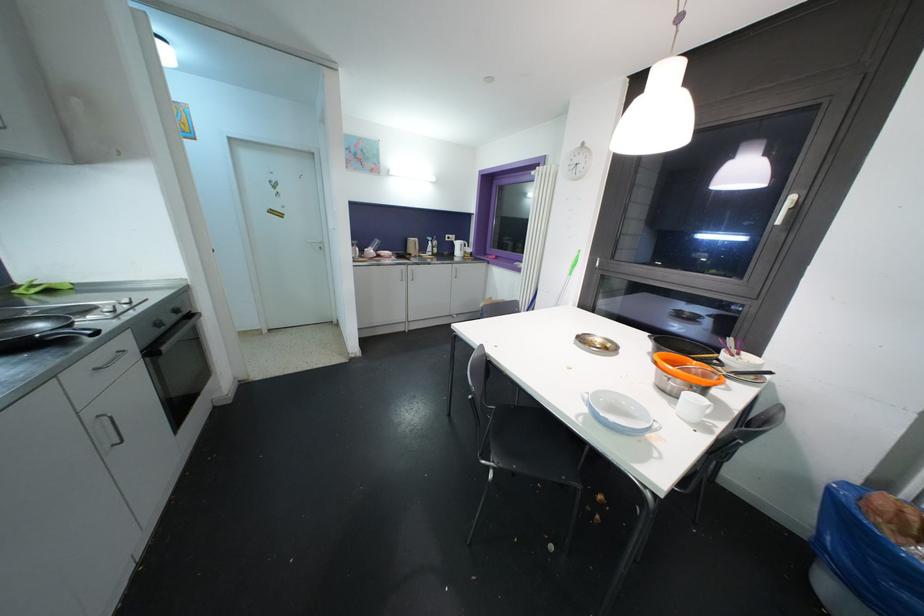
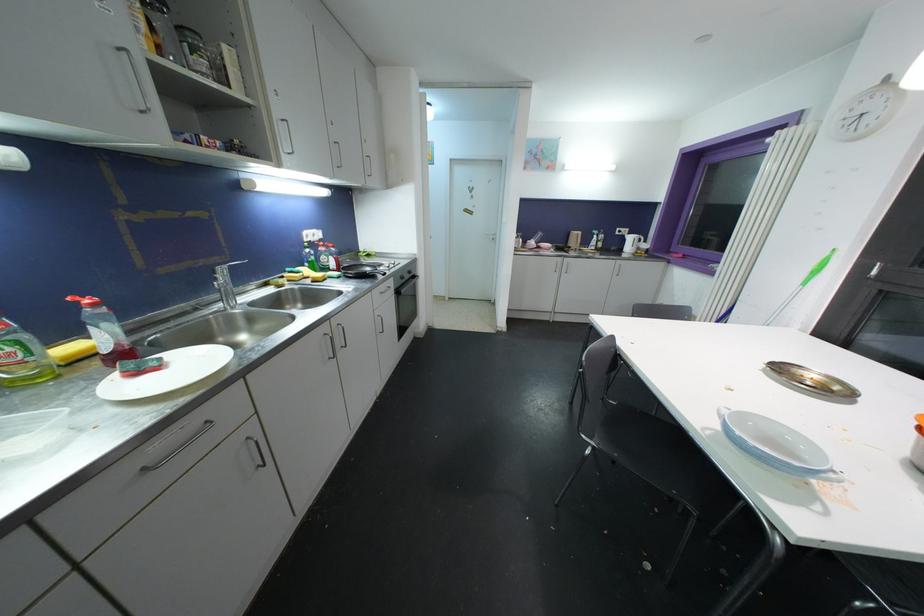
Where in the second image is the point corresponding to point (324, 251) from the first image?

(496, 241)